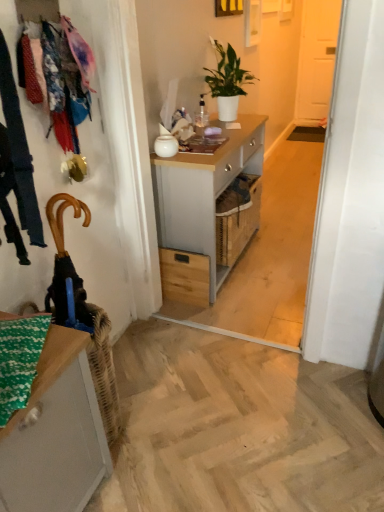
Where is `vacant space underneath white matte plant at center (from a real-world perspective)`? vacant space underneath white matte plant at center (from a real-world perspective) is located at coordinates (230, 121).